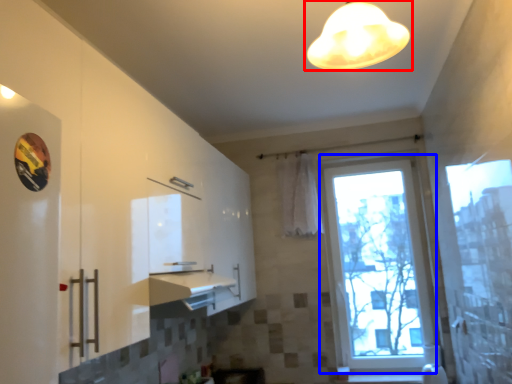
Question: Which object is closer to the camera taking this photo, lamp (highlighted by a red box) or window (highlighted by a blue box)?

Choices:
 (A) lamp
 (B) window

Answer: (A)